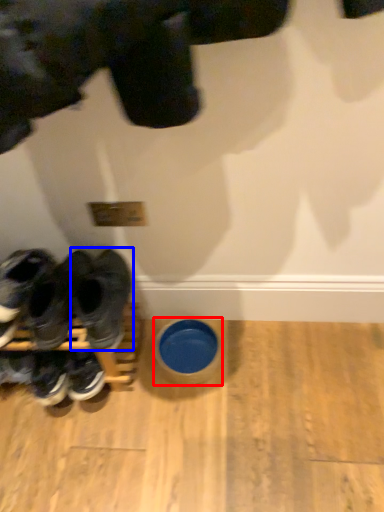
Question: Which object appears farthest to the camera in this image, bowl (highlighted by a red box) or footwear (highlighted by a blue box)?

Choices:
 (A) bowl
 (B) footwear

Answer: (A)